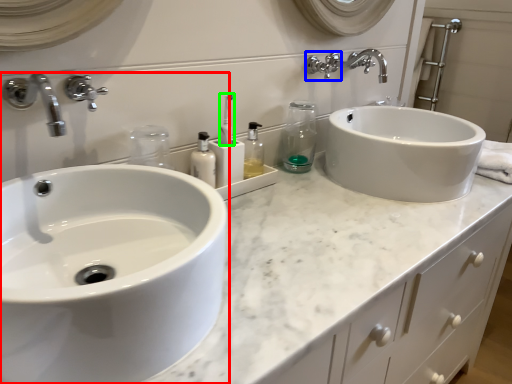
Question: Which object is positioned closest to sink (highlighted by a red box)? Select from plumbing fixture (highlighted by a blue box) and toothbrush (highlighted by a green box).

Choices:
 (A) plumbing fixture
 (B) toothbrush

Answer: (B)